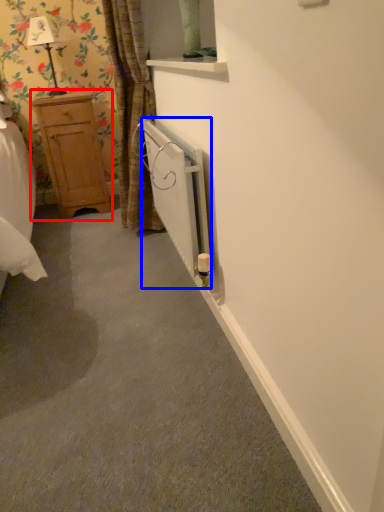
Question: Which of the following is the closest to the observer, dresser (highlighted by a red box) or radiator (highlighted by a blue box)?

Choices:
 (A) dresser
 (B) radiator

Answer: (B)